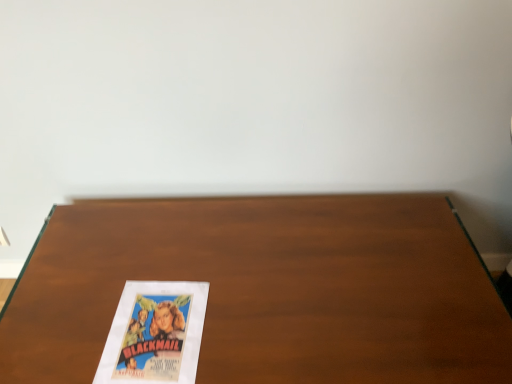
Question: Does wooden table at center lie behind vintage paper at bottom left?

Choices:
 (A) yes
 (B) no

Answer: (A)

Question: Considering the relative positions of wooden table at center and vintage paper at bottom left in the image provided, is wooden table at center to the right of vintage paper at bottom left from the viewer's perspective?

Choices:
 (A) no
 (B) yes

Answer: (B)

Question: Can you confirm if wooden table at center is thinner than vintage paper at bottom left?

Choices:
 (A) yes
 (B) no

Answer: (B)

Question: Is wooden table at center wider than vintage paper at bottom left?

Choices:
 (A) no
 (B) yes

Answer: (B)

Question: Could you tell me if wooden table at center is turned towards vintage paper at bottom left?

Choices:
 (A) yes
 (B) no

Answer: (B)

Question: From a real-world perspective, is wooden table at center located beneath vintage paper at bottom left?

Choices:
 (A) yes
 (B) no

Answer: (A)

Question: Can you confirm if vintage paper at bottom left is taller than wooden table at center?

Choices:
 (A) yes
 (B) no

Answer: (B)

Question: Can you confirm if vintage paper at bottom left is positioned to the left of wooden table at center?

Choices:
 (A) no
 (B) yes

Answer: (B)

Question: Could you tell me if vintage paper at bottom left is facing wooden table at center?

Choices:
 (A) no
 (B) yes

Answer: (B)

Question: Considering the relative sizes of vintage paper at bottom left and wooden table at center in the image provided, is vintage paper at bottom left smaller than wooden table at center?

Choices:
 (A) yes
 (B) no

Answer: (A)

Question: Can you confirm if vintage paper at bottom left is bigger than wooden table at center?

Choices:
 (A) yes
 (B) no

Answer: (B)

Question: From a real-world perspective, is vintage paper at bottom left under wooden table at center?

Choices:
 (A) yes
 (B) no

Answer: (B)

Question: From a real-world perspective, is wooden table at center above or below vintage paper at bottom left?

Choices:
 (A) below
 (B) above

Answer: (A)